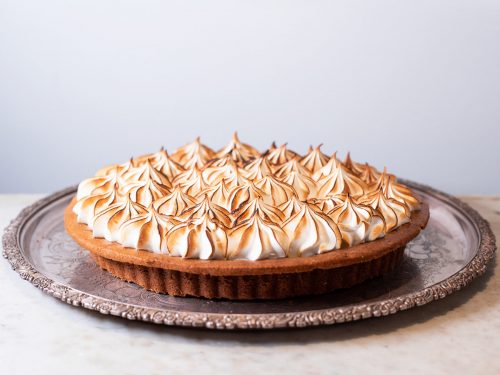
The width and height of the screenshot is (500, 375). I want to click on plate, so click(291, 330).